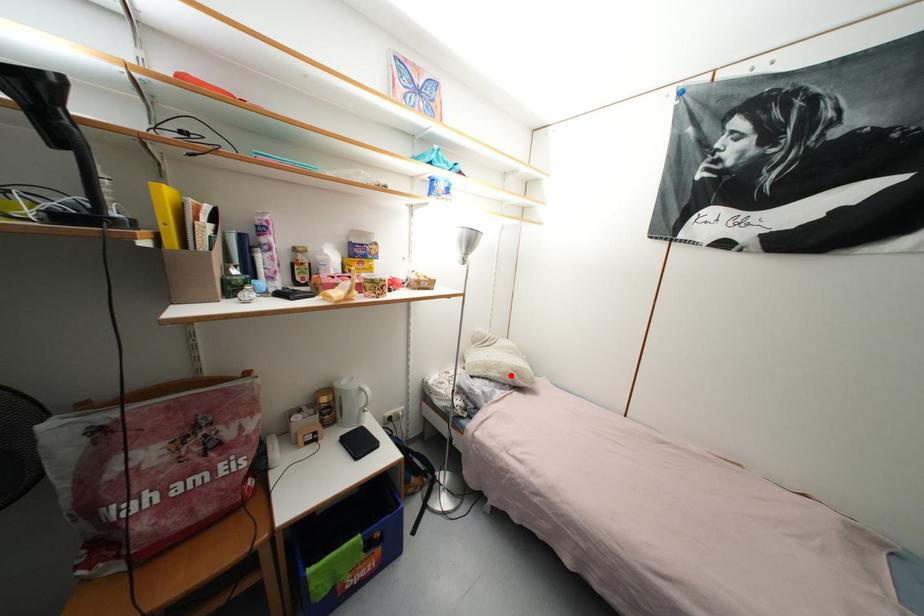
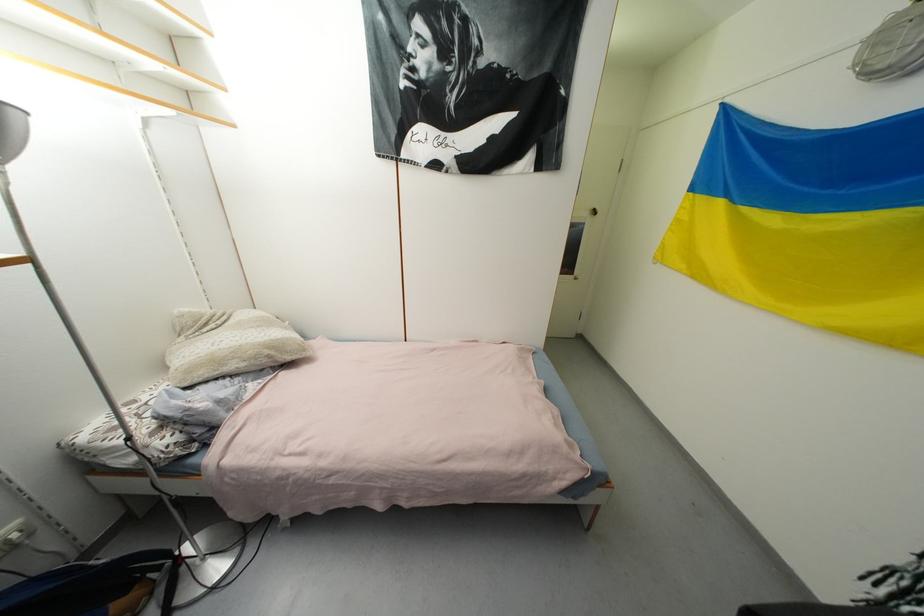
Question: I am providing you with two images of the same scene from different viewpoints. Given a red point in image1, look at the same physical point in image2. Is it:

Choices:
 (A) Closer to the viewpoint
 (B) Farther from the viewpoint

Answer: (A)